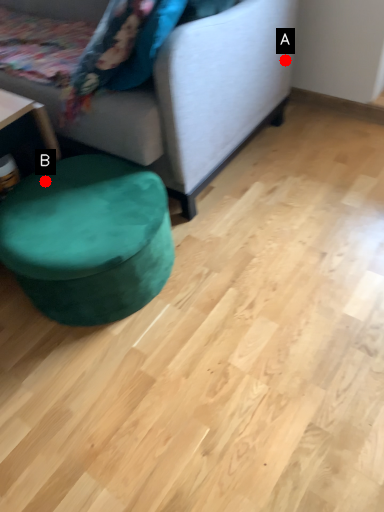
Question: Two points are circled on the image, labeled by A and B beside each circle. Which of the following is the farthest from the observer?

Choices:
 (A) A is further
 (B) B is further

Answer: (A)